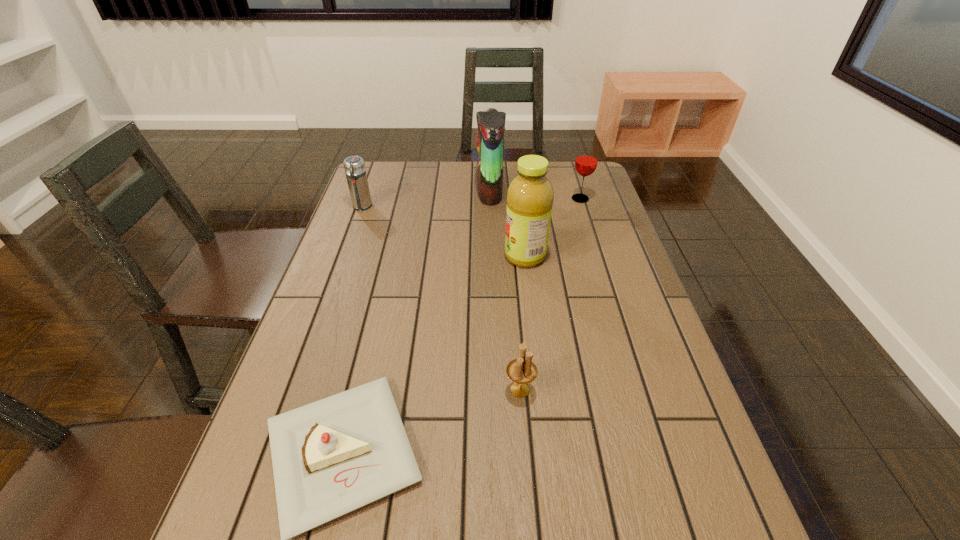
Locate an element on the screen. The width and height of the screenshot is (960, 540). blank space located 0.080m at the face of the parrot is located at coordinates (452, 191).

Locate an element on the screen. free space located 0.110m on the back of the glass is located at coordinates (573, 177).

This screenshot has height=540, width=960. Identify the location of vacant space situated with a handle on the side of the thermos bottle. (341, 265).

You are a GUI agent. You are given a task and a screenshot of the screen. Output one action in this format:
    pyautogui.click(x=<x>, y=<y>)
    Task: Click on the vacant space located 0.200m on the left of the candle holder
    
    Given the screenshot: What is the action you would take?
    pyautogui.click(x=408, y=390)

The height and width of the screenshot is (540, 960). What are the coordinates of `parrot present at the far edge` in the screenshot? It's located at (491, 124).

You are a GUI agent. You are given a task and a screenshot of the screen. Output one action in this format:
    pyautogui.click(x=<x>, y=<y>)
    Task: Click on the glass that is positioned at the far edge
    The image size is (960, 540).
    Given the screenshot: What is the action you would take?
    pyautogui.click(x=586, y=161)

The image size is (960, 540). I want to click on object that is at the left edge, so click(354, 166).

The image size is (960, 540). I want to click on object present at the right edge, so click(x=586, y=161).

Locate an element on the screen. This screenshot has height=540, width=960. object that is at the far right corner is located at coordinates (586, 161).

Image resolution: width=960 pixels, height=540 pixels. I want to click on vacant space at the far edge of the desktop, so (x=417, y=164).